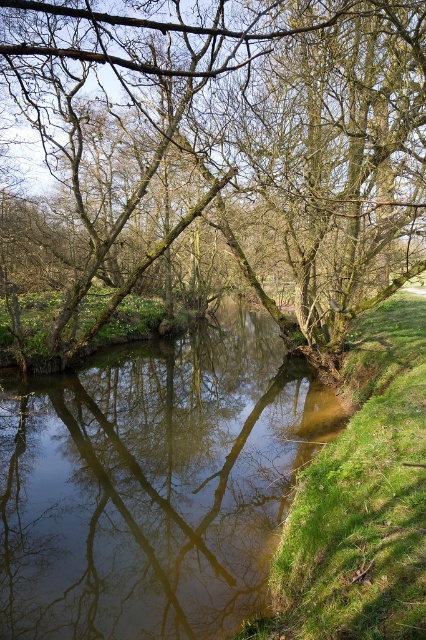
Who is more distant from viewer, (71, 330) or (97, 579)?

Positioned behind is point (71, 330).

Is smooth bark tree at center smaller than clear water at center?

Incorrect, smooth bark tree at center is not smaller in size than clear water at center.

Find the location of `smooth bark tree at center`. smooth bark tree at center is located at coordinates (216, 160).